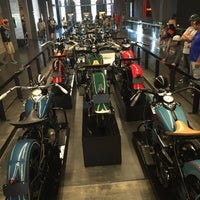
You are a GUI agent. You are given a task and a screenshot of the screen. Output one action in this format:
    pyautogui.click(x=<x>, y=<y>)
    Task: Click on the brown floor
    The width and height of the screenshot is (200, 200).
    Given the screenshot: What is the action you would take?
    pyautogui.click(x=99, y=179)